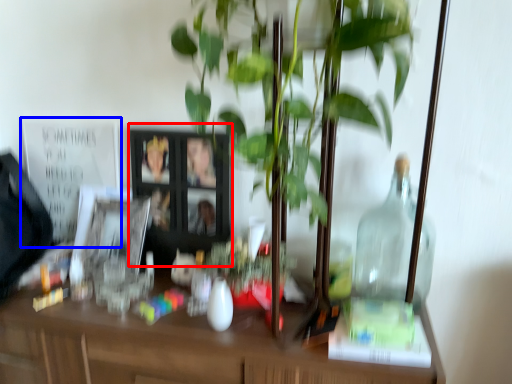
Question: Which object appears closest to the camera in this image, picture frame (highlighted by a red box) or bulletin board (highlighted by a blue box)?

Choices:
 (A) picture frame
 (B) bulletin board

Answer: (A)